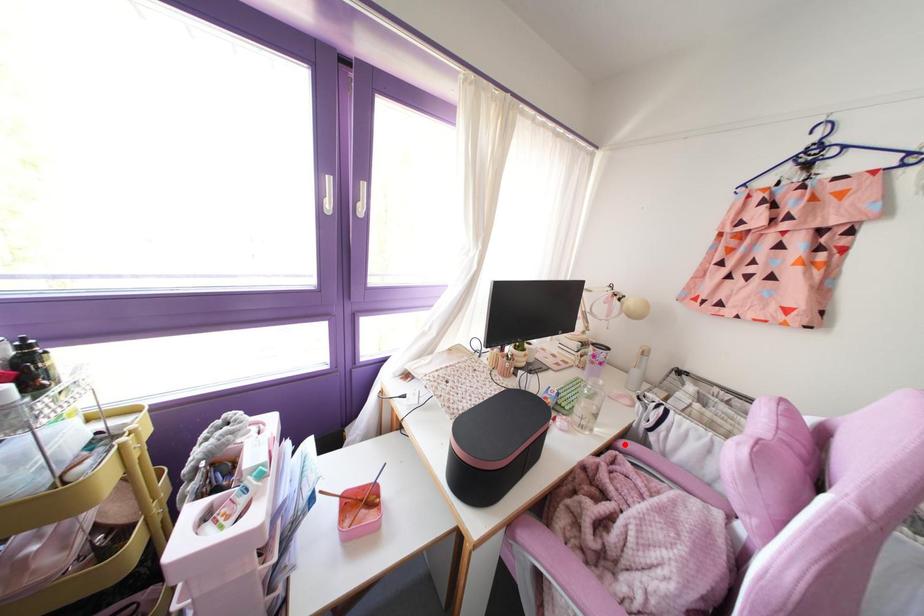
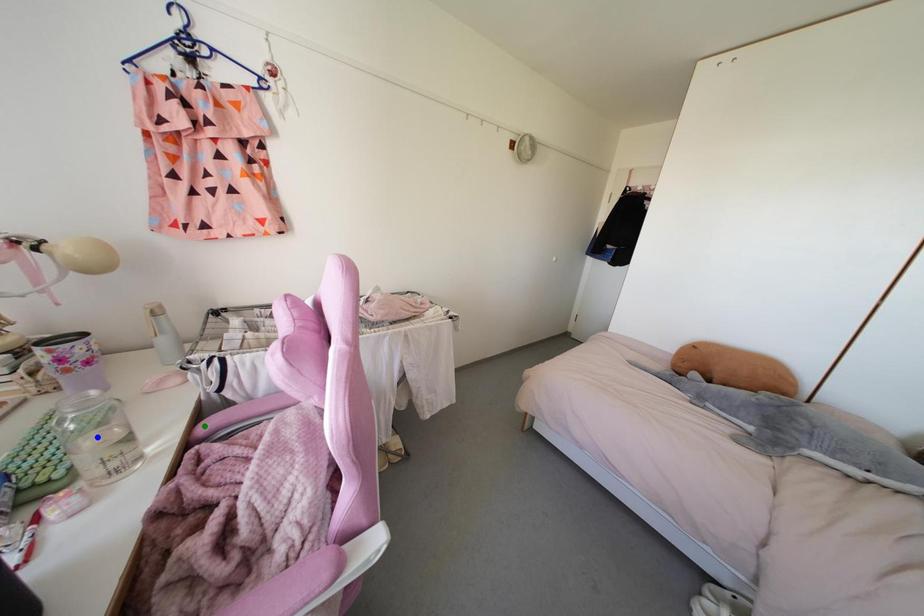
Question: I am providing you with two images of the same scene from different viewpoints. A red point is marked on the first image. You are given multiple points on the second image. Which spot in image 2 lines up with the point in image 1?

Choices:
 (A) green point
 (B) yellow point
 (C) blue point

Answer: (A)